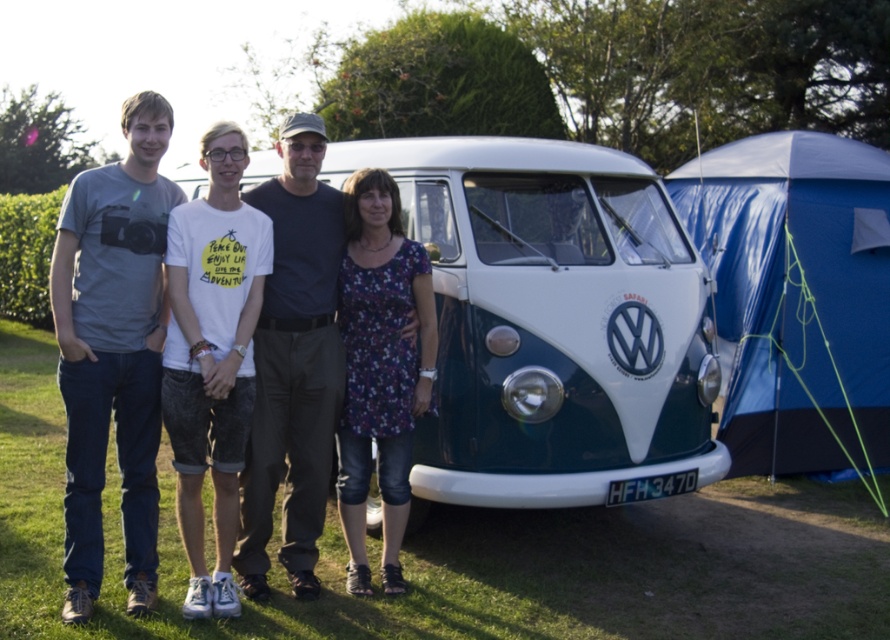
Does white glossy van at center have a greater width compared to blue tarpaulin tent at right?

Indeed, white glossy van at center has a greater width compared to blue tarpaulin tent at right.

Can you confirm if white glossy van at center is positioned below blue tarpaulin tent at right?

Correct, white glossy van at center is located below blue tarpaulin tent at right.

Is point (596, 268) less distant than point (864, 396)?

That is True.

What are the coordinates of `white glossy van at center` in the screenshot? It's located at (552, 323).

Between point (241, 328) and point (301, 172), which one is positioned behind?

Positioned behind is point (301, 172).

Does white cotton t-shirt at center appear on the left side of dark blue cotton shirt at center?

Correct, you'll find white cotton t-shirt at center to the left of dark blue cotton shirt at center.

Is point (191, 314) in front of point (253, 579)?

Yes.

This screenshot has height=640, width=890. Identify the location of white cotton t-shirt at center. (154, 356).

Identify the location of blue tarpaulin tent at right. coord(797,296).

Who is more forward, (791, 308) or (279, 232)?

Positioned in front is point (279, 232).

At what (x,y) coordinates should I click in order to perform the action: click on blue tarpaulin tent at right. Please return your answer as a coordinate pair (x, y). This screenshot has height=640, width=890. Looking at the image, I should click on (797, 296).